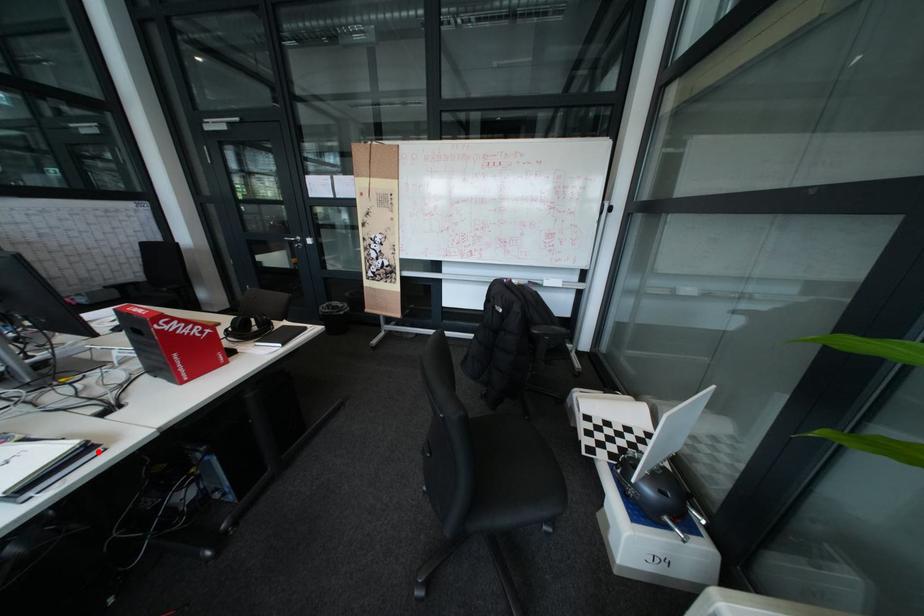
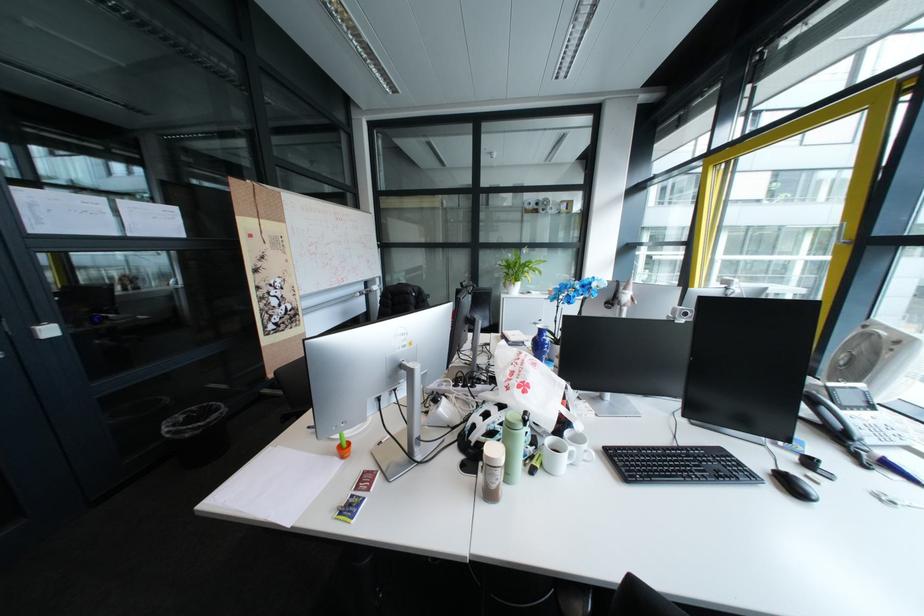
Question: I am providing you with two images of the same scene from different viewpoints. A red point is marked on the first image. Can you still see the location of the red point in image 2?

Choices:
 (A) Yes
 (B) No

Answer: (B)